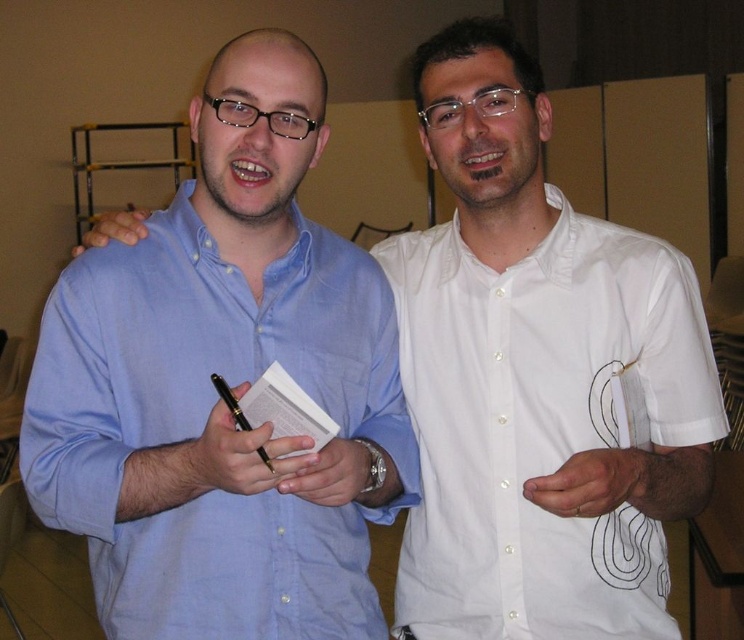
Question: Is white matte hand at center below metallic wristwatch at center?

Choices:
 (A) no
 (B) yes

Answer: (A)

Question: Is metallic wristwatch at center to the left of matte skin hand at center from the viewer's perspective?

Choices:
 (A) yes
 (B) no

Answer: (B)

Question: Which object appears farthest from the camera in this image?

Choices:
 (A) black glossy pen at center
 (B) white cotton shirt at right
 (C) matte skin hand at center

Answer: (C)

Question: Which object appears farthest from the camera in this image?

Choices:
 (A) white matte hand at center
 (B) matte blue shirt at left
 (C) black glossy pen at center
 (D) white cotton shirt at right

Answer: (D)

Question: Is white cotton shirt at right smaller than matte skin hand at center?

Choices:
 (A) yes
 (B) no

Answer: (B)

Question: Which point is farther to the camera?

Choices:
 (A) pos(289,448)
 (B) pos(124,220)
 (C) pos(618,500)

Answer: (B)